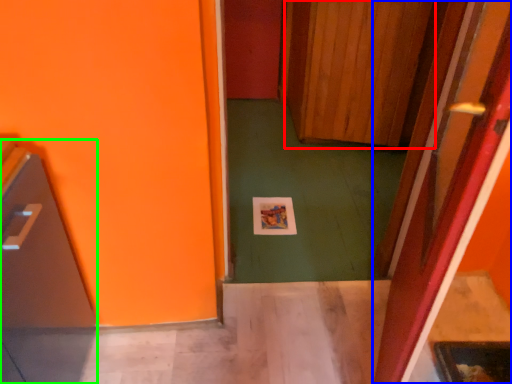
Question: Which object is positioned closest to door (highlighted by a red box)? Select from door (highlighted by a blue box) and appliance (highlighted by a green box).

Choices:
 (A) door
 (B) appliance

Answer: (A)